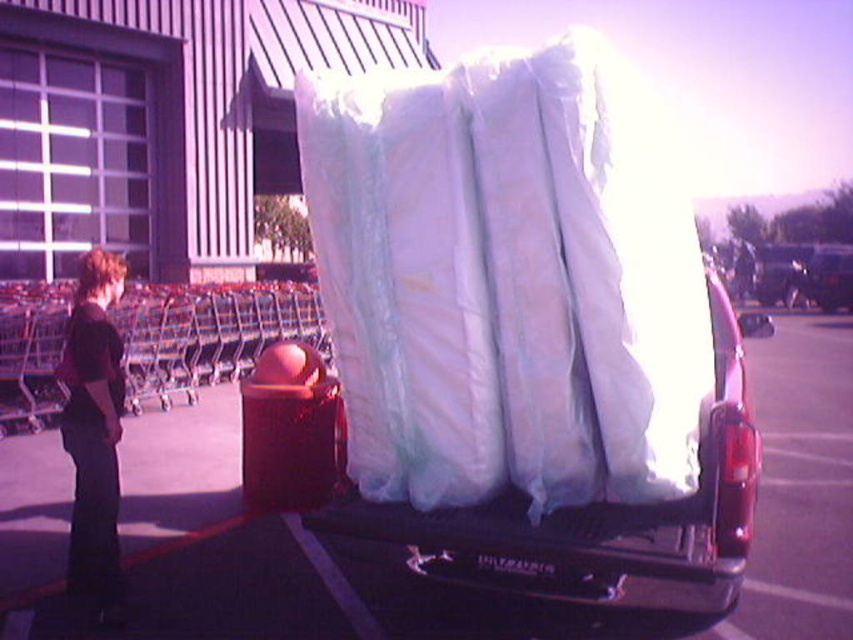
Is translucent plastic mattress at center wider than dark brown hair at left?

Correct, the width of translucent plastic mattress at center exceeds that of dark brown hair at left.

Who is more distant from viewer, (x=561, y=100) or (x=122, y=388)?

The point (x=122, y=388) is more distant.

What do you see at coordinates (508, 280) in the screenshot? I see `translucent plastic mattress at center` at bounding box center [508, 280].

This screenshot has width=853, height=640. In order to click on translucent plastic mattress at center in this screenshot , I will do `click(508, 280)`.